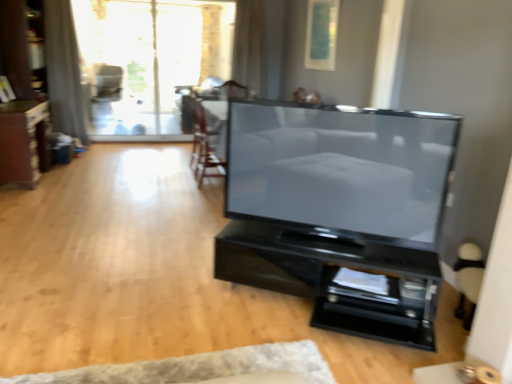
Question: Considering the relative sizes of black glossy tv stand at center, the 2th furniture viewed from the back, and white textured rug at lower center in the image provided, is black glossy tv stand at center, the 2th furniture viewed from the back, shorter than white textured rug at lower center?

Choices:
 (A) no
 (B) yes

Answer: (A)

Question: From a real-world perspective, does black glossy tv stand at center, marked as the 2th furniture in a top-to-bottom arrangement, sit lower than white textured rug at lower center?

Choices:
 (A) no
 (B) yes

Answer: (A)

Question: Considering the relative positions of black glossy tv stand at center, which is the 1th furniture from front to back, and white textured rug at lower center in the image provided, is black glossy tv stand at center, which is the 1th furniture from front to back, in front of white textured rug at lower center?

Choices:
 (A) yes
 (B) no

Answer: (B)

Question: Does black glossy tv stand at center, which is counted as the first furniture, starting from the bottom, have a smaller size compared to white textured rug at lower center?

Choices:
 (A) yes
 (B) no

Answer: (B)

Question: Is black glossy tv stand at center, which ranks as the first furniture in right-to-left order, surrounding white textured rug at lower center?

Choices:
 (A) yes
 (B) no

Answer: (B)

Question: Is white sheer curtain at upper center, which is the 1th curtain in right-to-left order, bigger or smaller than matte black armchair at upper center, the first armchair when ordered from top to bottom?

Choices:
 (A) small
 (B) big

Answer: (A)

Question: From a real-world perspective, is white sheer curtain at upper center, which is the 1th curtain in right-to-left order, positioned above or below matte black armchair at upper center, positioned as the second armchair in bottom-to-top order?

Choices:
 (A) below
 (B) above

Answer: (B)

Question: Visually, is white sheer curtain at upper center, placed as the 2th curtain when sorted from left to right, positioned to the left or to the right of matte black armchair at upper center, positioned as the second armchair in bottom-to-top order?

Choices:
 (A) left
 (B) right

Answer: (B)

Question: In the image, is white sheer curtain at upper center, placed as the 2th curtain when sorted from left to right, positioned in front of or behind matte black armchair at upper center, positioned as the second armchair in bottom-to-top order?

Choices:
 (A) behind
 (B) front

Answer: (B)

Question: Is matte black tv at center inside or outside of matte black armchair at upper center, the second armchair viewed from the front?

Choices:
 (A) outside
 (B) inside

Answer: (A)

Question: Is matte black tv at center to the left or to the right of matte black armchair at upper center, the first armchair when ordered from top to bottom, in the image?

Choices:
 (A) left
 (B) right

Answer: (B)

Question: Is matte black tv at center wider or thinner than matte black armchair at upper center, the first armchair from the left?

Choices:
 (A) thin
 (B) wide

Answer: (A)

Question: From the image's perspective, is matte black tv at center positioned above or below matte black armchair at upper center, the first armchair from the left?

Choices:
 (A) above
 (B) below

Answer: (B)

Question: Which is correct: gray fabric curtain at upper left, which appears as the 1th curtain when viewed from the left, is inside dark brown wood dresser at left, or outside of it?

Choices:
 (A) outside
 (B) inside

Answer: (A)

Question: From their relative heights in the image, would you say gray fabric curtain at upper left, placed as the second curtain when sorted from right to left, is taller or shorter than dark brown wood dresser at left?

Choices:
 (A) short
 (B) tall

Answer: (B)